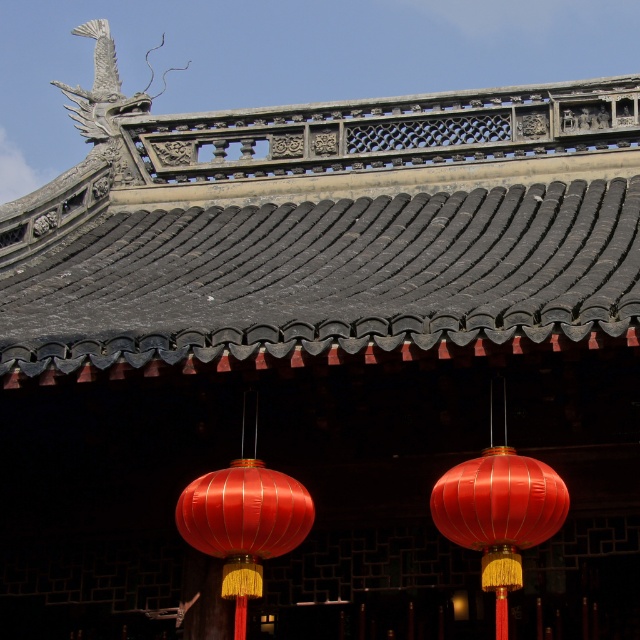
You are an architect examining the roof of this traditional East Asian building. You notice a specific point on the roof at coordinates point (324, 225). What type of material is located at that exact point?

The point (324, 225) is covered with dark gray textured tiles at upper center.

You are an architect designing a traditional East Asian building. You want to ensure that the shiny red silk lantern at center is visible from the ground without obstruction. Given the dark gray textured tiles at upper center, will the lantern be visible from below?

The dark gray textured tiles at upper center are positioned over the shiny red silk lantern at center, so the lantern will be partially or fully obscured by the tiles. To ensure visibility, the lantern should be repositioned or the tiles adjusted.

You are an architect examining the roof of this traditional East Asian building. You notice the dark gray textured tiles at upper center and the satin red lantern at center. Which object is closer to you from your viewpoint?

The dark gray textured tiles at upper center are closer to you because they are in front of the satin red lantern at center.